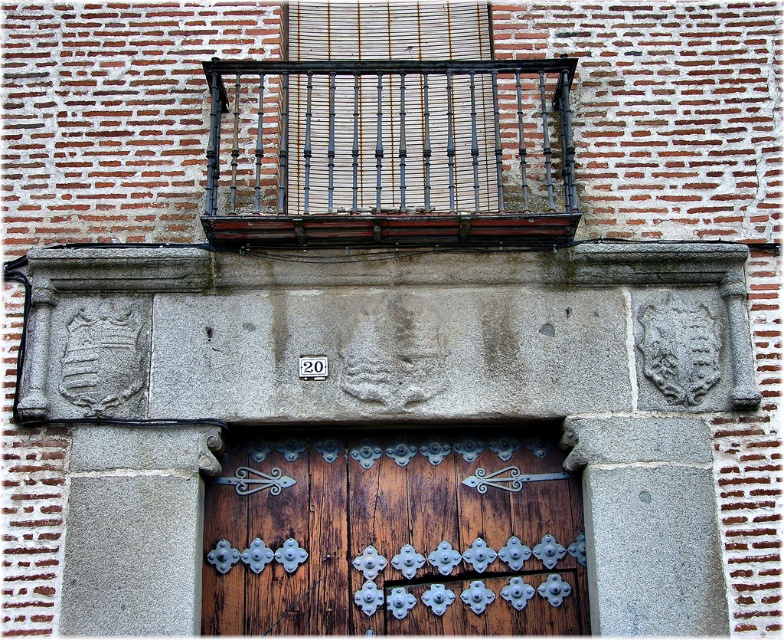
Who is higher up, wooden door with metal hinges at center or rusty metal balcony at upper center?

Positioned higher is rusty metal balcony at upper center.

Which of these two, wooden door with metal hinges at center or rusty metal balcony at upper center, stands taller?

wooden door with metal hinges at center

Which is behind, point (454, 627) or point (251, 202)?

Point (251, 202)

At what (x,y) coordinates should I click in order to perform the action: click on wooden door with metal hinges at center. Please return your answer as a coordinate pair (x, y). This screenshot has height=640, width=784. Looking at the image, I should click on (394, 534).

Is rusty metal balcony at upper center above wooden slats at center?

Actually, rusty metal balcony at upper center is below wooden slats at center.

Is point (207, 188) behind point (394, 32)?

No, it is not.

Which is behind, point (211, 209) or point (443, 3)?

Point (443, 3)

Where is `rusty metal balcony at upper center`? The image size is (784, 640). rusty metal balcony at upper center is located at coordinates (390, 152).

Does wooden door with metal hinges at center have a lesser width compared to wooden slats at center?

Incorrect, wooden door with metal hinges at center's width is not less than wooden slats at center's.

The width and height of the screenshot is (784, 640). What do you see at coordinates (394, 534) in the screenshot? I see `wooden door with metal hinges at center` at bounding box center [394, 534].

Find the location of a particular element. This screenshot has width=784, height=640. wooden door with metal hinges at center is located at coordinates (394, 534).